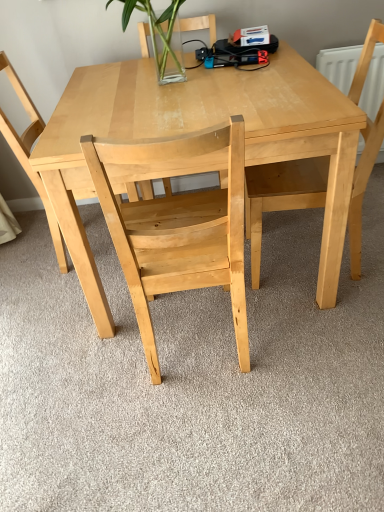
This screenshot has height=512, width=384. What are the coordinates of `free location above natural wood table at center (from a real-world perspective)` in the screenshot? It's located at (183, 84).